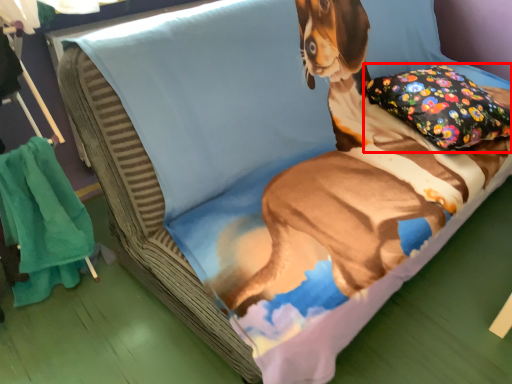
Question: From the image's perspective, where is pillow (annotated by the red box) located in relation to blanket in the image?

Choices:
 (A) below
 (B) above

Answer: (B)